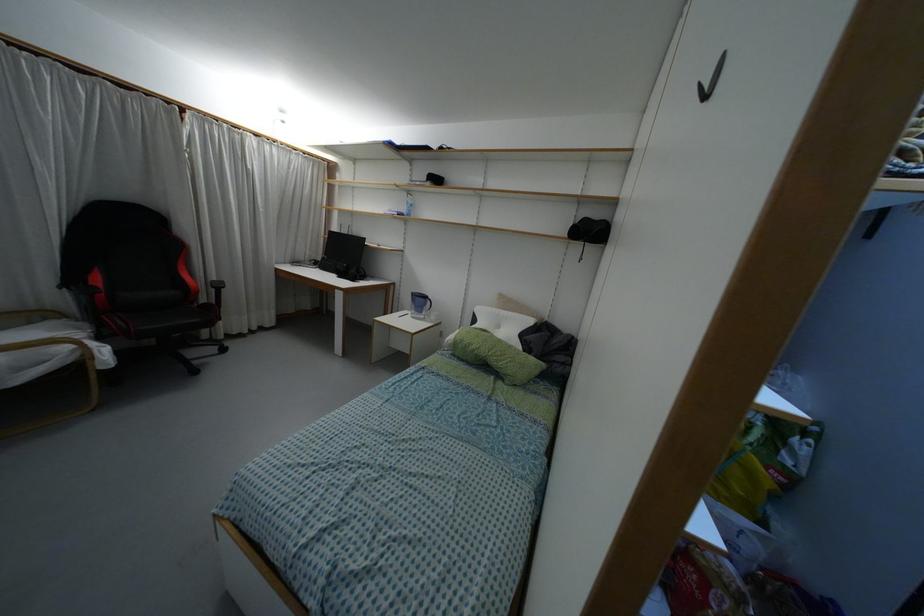
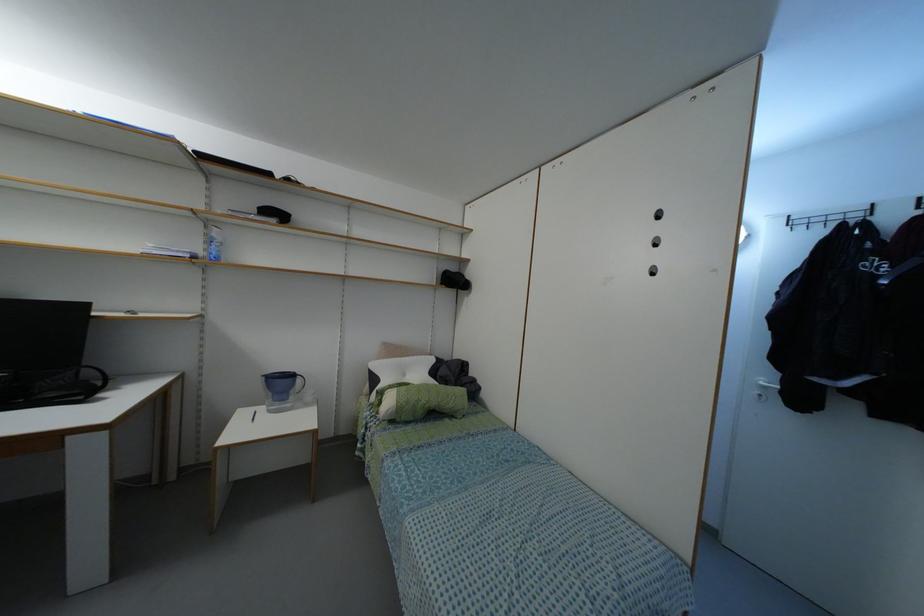
In the second image, find the point that corresponds to point (407, 215) in the first image.

(216, 257)